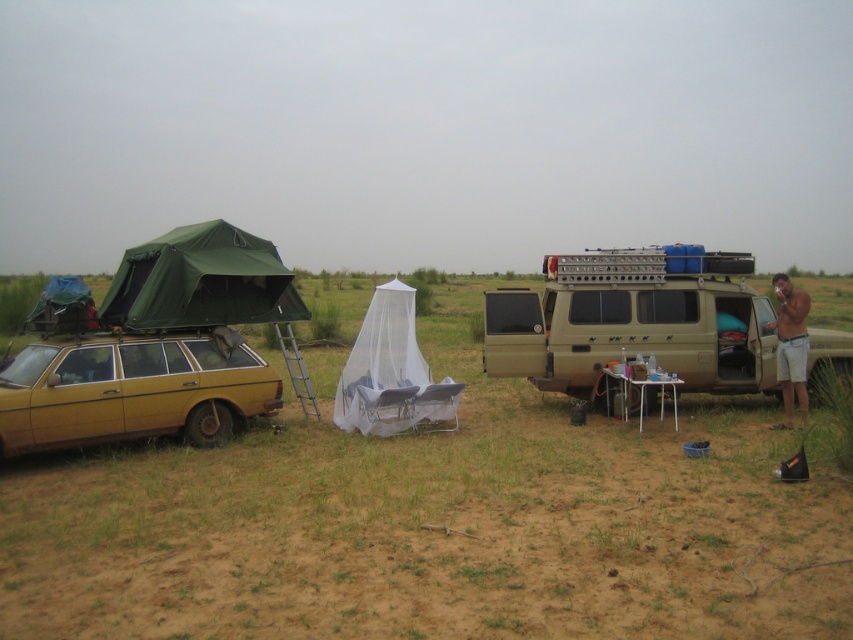
In the scene shown: Is matte black tent at left to the right of green fabric tent at upper left from the viewer's perspective?

Incorrect, matte black tent at left is not on the right side of green fabric tent at upper left.

Does matte black tent at left appear on the left side of green fabric tent at upper left?

Yes, matte black tent at left is to the left of green fabric tent at upper left.

In order to click on matte black tent at left in this screenshot , I will do `click(154, 344)`.

Between yellow matte station wagon at left and brown textured shorts at right, which one has more height?

brown textured shorts at right is taller.

Who is more distant from viewer, (96, 392) or (801, 387)?

Positioned behind is point (801, 387).

Identify the location of yellow matte station wagon at left. (131, 390).

Is green fabric tent at upper left to the right of brown textured shorts at right from the viewer's perspective?

Incorrect, green fabric tent at upper left is not on the right side of brown textured shorts at right.

Between green fabric tent at upper left and brown textured shorts at right, which one is positioned higher?

brown textured shorts at right is above.

What do you see at coordinates (200, 282) in the screenshot?
I see `green fabric tent at upper left` at bounding box center [200, 282].

The image size is (853, 640). I want to click on green fabric tent at upper left, so click(200, 282).